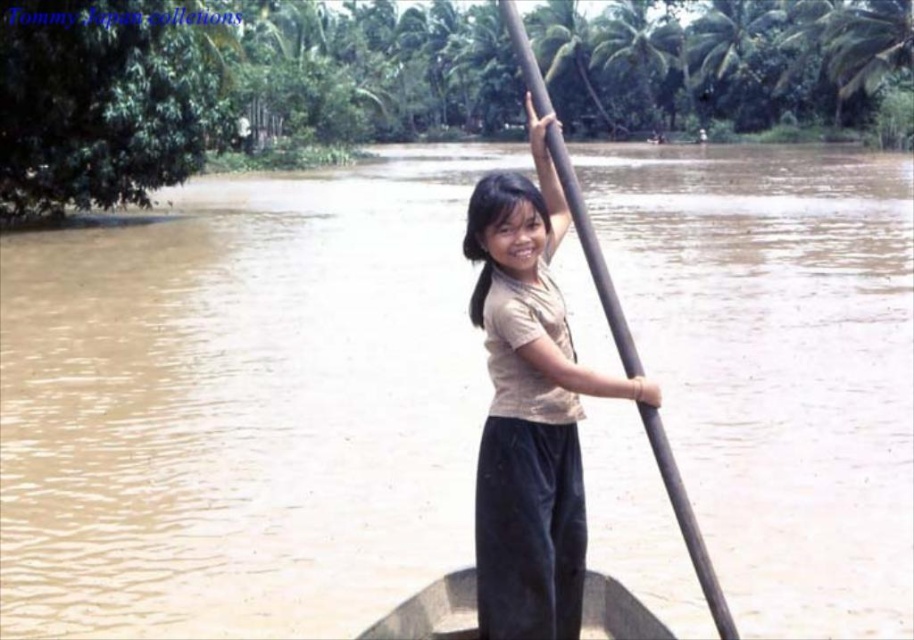
You are a photographer trying to capture the girl in the boat. You want to ensure both the matte brown shirt at center and the dark brown wood canoe at center are clearly visible. Which object should you focus on to ensure the wider one is in focus?

The matte brown shirt at center is wider than the dark brown wood canoe at center, so you should focus on the matte brown shirt at center to ensure the wider object is in focus.

You are a photographer trying to capture the girl in the matte brown shirt at center and the dark brown wood canoe at center. Since both are in the same location, which one should you focus on to ensure the subject is closer to the camera?

The matte brown shirt at center is in front of the dark brown wood canoe at center, so focusing on the matte brown shirt at center will ensure the subject is closer to the camera.

The girl is standing in a boat on a muddy river. She is wearing a light colored short sleeved shirt and dark pants. There is a point at coordinates (x=529, y=406). What is located at that point?

The point at coordinates (x=529, y=406) has a matte brown shirt at center.